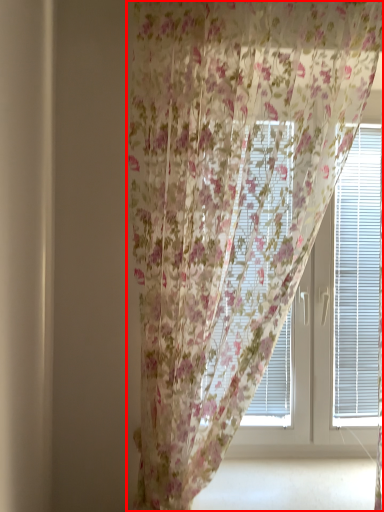
Question: Observing the image, what is the correct spatial positioning of curtain (annotated by the red box) in reference to bay window?

Choices:
 (A) left
 (B) right

Answer: (A)